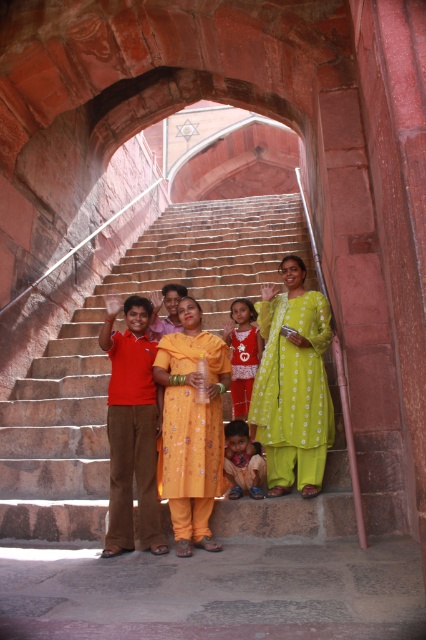
You are standing at the base of the grand staircase in the historical site. You notice two points marked in the scene. If you were to walk towards the staircase, which point would you encounter first, point (278,364) or point (178,460)?

Point (178,460) would be encountered first because it is in front of point (278,364) according to their positions in the scene.

You are standing at the top of the grand staircase and want to take a photo of the lime green fabric at center and the light brown fabric at lower center. Which fabric will appear larger in your photo?

The lime green fabric at center will appear larger in the photo because it is closer to the viewer than the light brown fabric at lower center.

In the scene shown: You are standing at the bottom of the grand staircase and want to take a photo of the group. The lime green fabric at center and the yellow embroidered dress at center are both in the scene. Which one is closer to the camera?

The lime green fabric at center is closer to the camera because the yellow embroidered dress at center is behind it.